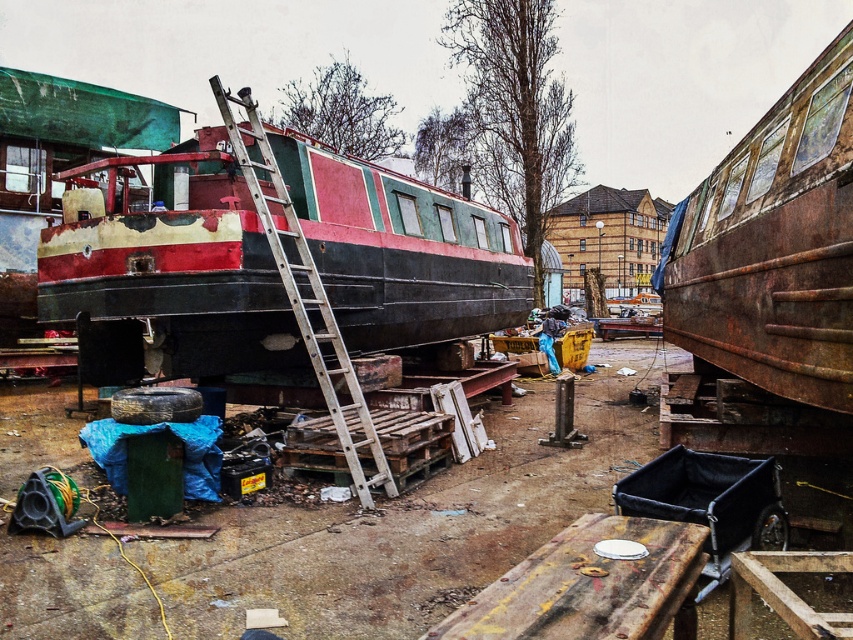
You are a worker in the boatyard and need to locate the rusty metal train car at right. According to the coordinates provided, where exactly should you look?

The rusty metal train car at right is located at point (776, 244).

You are a technician standing in the boatyard and need to access both points marked in the scene. Which point, point (x=364, y=221) or point (x=334, y=332), is closer to you?

Point (x=364, y=221) is closer to you because it is further to the viewer than point (x=334, y=332), meaning it requires less distance to reach.